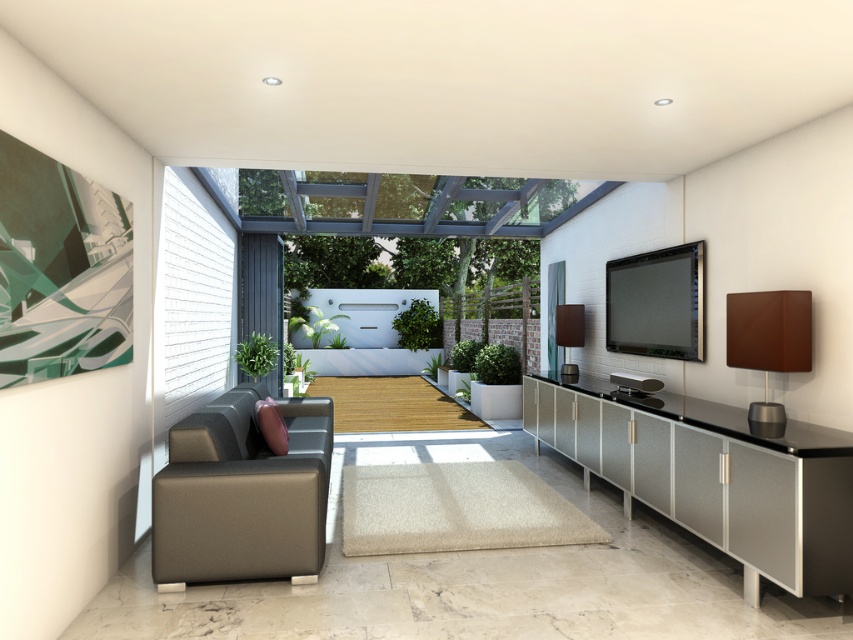
Question: Is metallic textured cabinet at lower right to the left of matte brown leather couch at lower left from the viewer's perspective?

Choices:
 (A) no
 (B) yes

Answer: (A)

Question: Can you confirm if metallic textured cabinet at lower right is positioned above matte brown leather couch at lower left?

Choices:
 (A) yes
 (B) no

Answer: (B)

Question: Where is metallic textured cabinet at lower right located in relation to matte brown leather couch at lower left in the image?

Choices:
 (A) above
 (B) below

Answer: (B)

Question: Which point appears farthest from the camera in this image?

Choices:
 (A) (253, 492)
 (B) (773, 444)

Answer: (A)